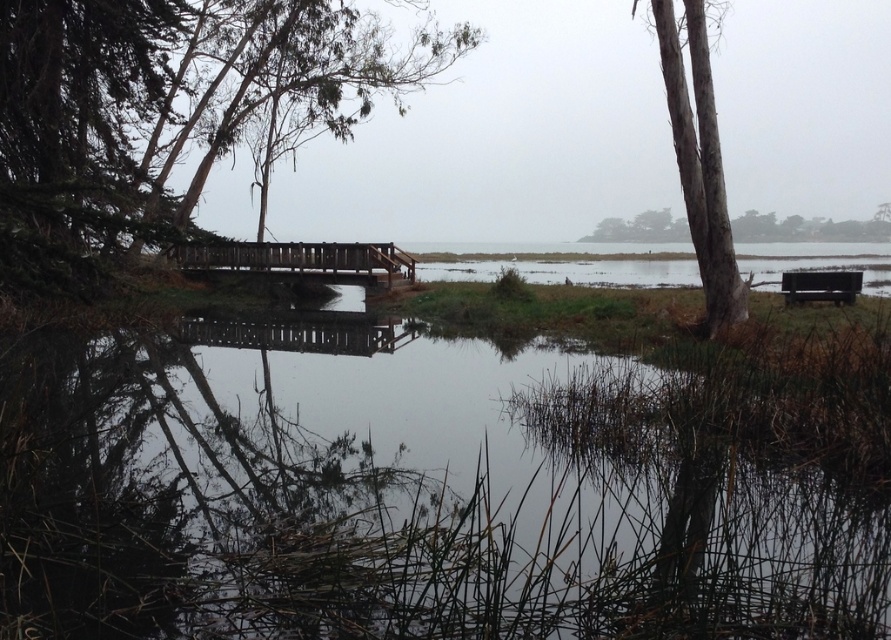
Question: Observing the image, what is the correct spatial positioning of wooden bridge at center in reference to smooth bark tree at upper right?

Choices:
 (A) below
 (B) above

Answer: (A)

Question: Which of the following is the closest to the observer?

Choices:
 (A) smooth bark tree at upper right
 (B) green matte tree at left
 (C) white textured bark tree at right
 (D) wooden bridge at center

Answer: (B)

Question: Can you confirm if white textured bark tree at right is positioned below wooden bridge at center?

Choices:
 (A) no
 (B) yes

Answer: (A)

Question: Is green matte tree at left behind wooden bridge at center?

Choices:
 (A) no
 (B) yes

Answer: (A)

Question: Which point is farther from the camera taking this photo?

Choices:
 (A) [611, 224]
 (B) [714, 259]
 (C) [199, 262]

Answer: (A)

Question: Considering the real-world distances, which object is farthest from the green matte tree at left?

Choices:
 (A) smooth bark tree at upper right
 (B) wooden bridge at center
 (C) white textured bark tree at right

Answer: (A)